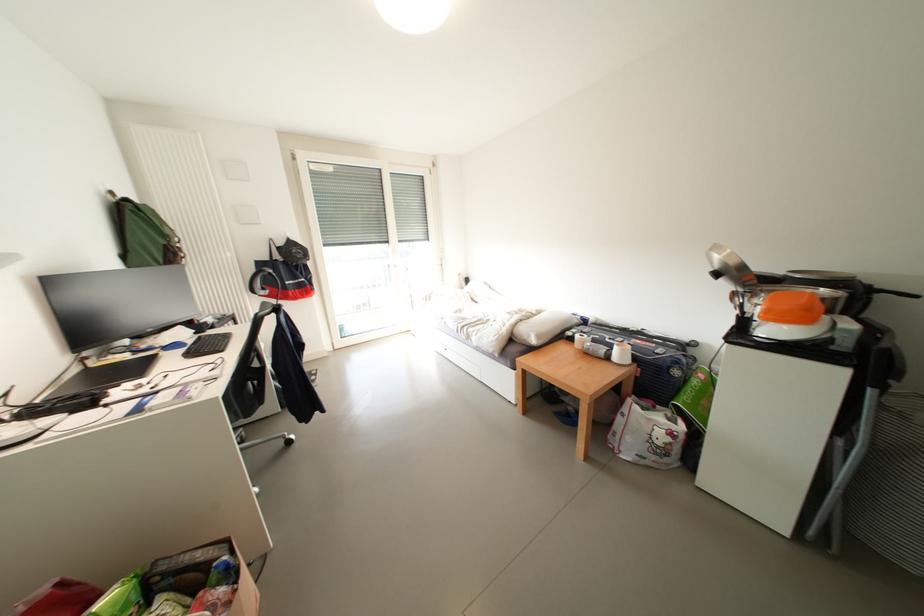
Which object does [283,273] point to?

It corresponds to the red and black bag in the image.